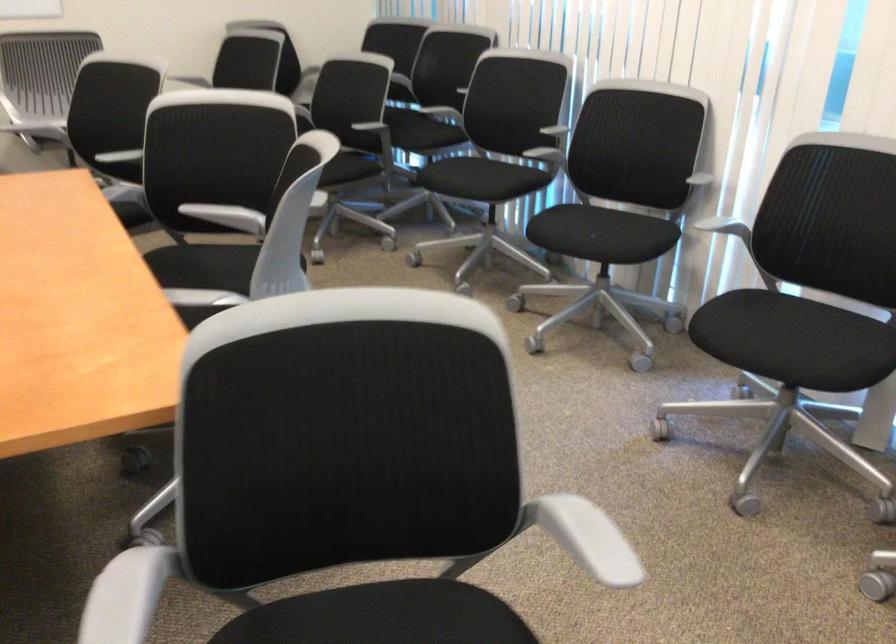
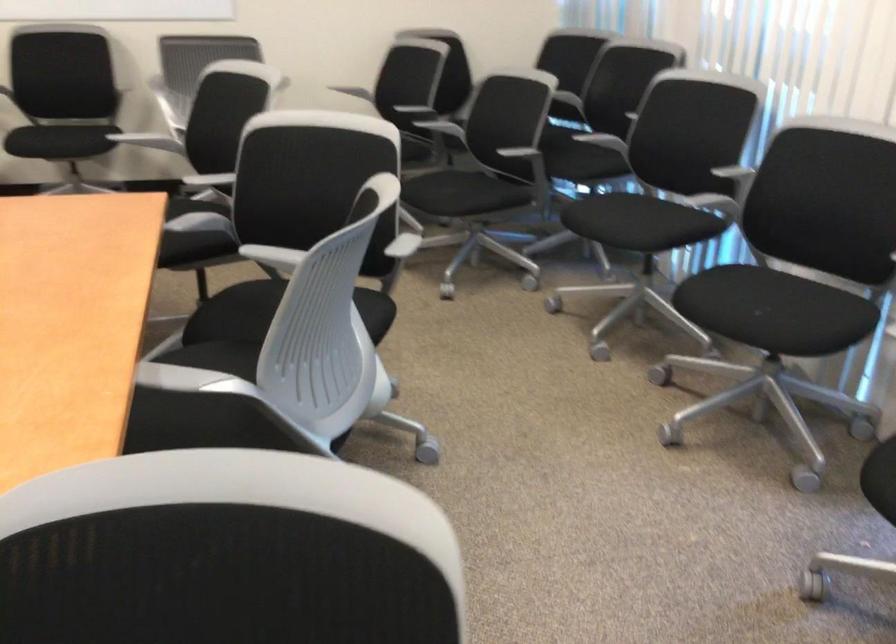
The point at [279,91] is marked in the first image. Where is the corresponding point in the second image?

(432, 107)